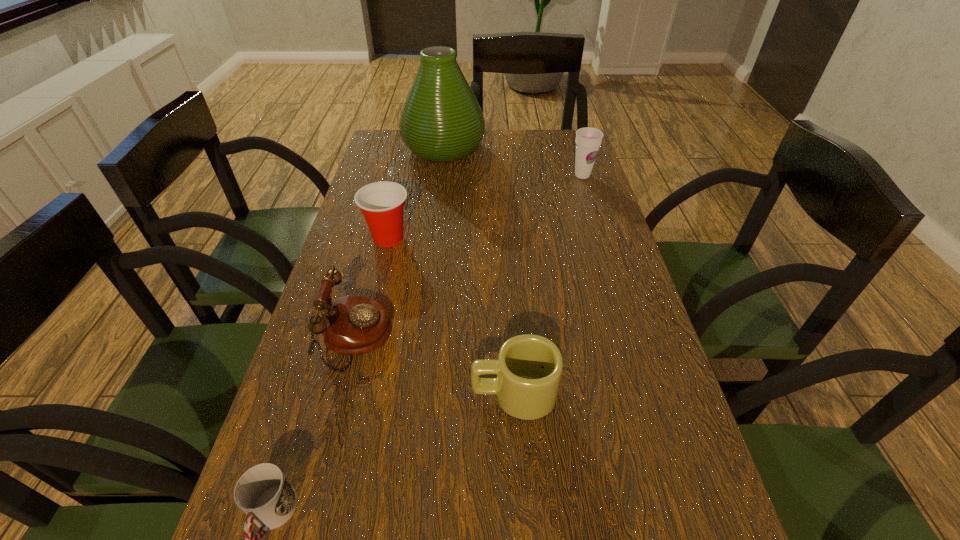
At what (x,y) coordinates should I click in order to perform the action: click on free space located 0.350m with the handle on the side of the mug. Please return your answer as a coordinate pair (x, y). This screenshot has width=960, height=540. Looking at the image, I should click on (289, 394).

You are a GUI agent. You are given a task and a screenshot of the screen. Output one action in this format:
    pyautogui.click(x=<x>, y=<y>)
    Task: Click on the vacant space located 0.310m with the handle on the side of the mug
    The height and width of the screenshot is (540, 960).
    Given the screenshot: What is the action you would take?
    pyautogui.click(x=309, y=394)

At what (x,y) coordinates should I click in order to perform the action: click on free spot located with the handle on the side of the mug. Please return your answer as a coordinate pair (x, y). Looking at the image, I should click on (335, 394).

The width and height of the screenshot is (960, 540). What are the coordinates of `object that is positioned at the far edge` in the screenshot? It's located at (441, 120).

Find the location of a particular element. The image size is (960, 540). vase at the left edge is located at coordinates (441, 120).

This screenshot has height=540, width=960. In order to click on cup that is at the left edge in this screenshot , I will do `click(382, 203)`.

This screenshot has width=960, height=540. I want to click on telephone at the left edge, so click(351, 325).

Where is `object at the right edge`? The width and height of the screenshot is (960, 540). object at the right edge is located at coordinates (588, 140).

Where is `object that is at the far left corner`? object that is at the far left corner is located at coordinates (441, 120).

Image resolution: width=960 pixels, height=540 pixels. In order to click on vacant space at the far edge of the desktop in this screenshot , I will do `click(508, 153)`.